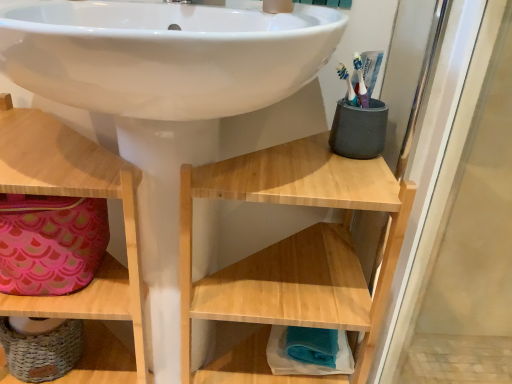
At what (x,y) coordinates should I click in order to perform the action: click on teal fabric towel at lower center, which is the 1th shelf in right-to-left order. Please return your answer as a coordinate pair (x, y). Image resolution: width=512 pixels, height=384 pixels. Looking at the image, I should click on (254, 366).

Locate an element on the screen. wooden shelf at lower left, marked as the 1th shelf in a left-to-right arrangement is located at coordinates (105, 256).

This screenshot has width=512, height=384. Identify the location of pink fabric bag at lower left. (50, 243).

In terms of height, does natural wood shelf at center, positioned as the 2th shelf in left-to-right order, look taller or shorter compared to teal fabric towel at lower center, which is the 1th shelf in right-to-left order?

Clearly, natural wood shelf at center, positioned as the 2th shelf in left-to-right order, is taller compared to teal fabric towel at lower center, which is the 1th shelf in right-to-left order.

Considering the sizes of objects natural wood shelf at center, which ranks as the 2th shelf in right-to-left order, and teal fabric towel at lower center, which is the 1th shelf in right-to-left order, in the image provided, who is bigger, natural wood shelf at center, which ranks as the 2th shelf in right-to-left order, or teal fabric towel at lower center, which is the 1th shelf in right-to-left order,?

natural wood shelf at center, which ranks as the 2th shelf in right-to-left order, is bigger.

Is natural wood shelf at center, positioned as the 2th shelf in left-to-right order, surrounding teal fabric towel at lower center, the third shelf positioned from the left?

Yes, teal fabric towel at lower center, the third shelf positioned from the left, is a part of natural wood shelf at center, positioned as the 2th shelf in left-to-right order.

Could you measure the distance between natural wood shelf at center, positioned as the 2th shelf in left-to-right order, and teal fabric towel at lower center, the third shelf positioned from the left?

natural wood shelf at center, positioned as the 2th shelf in left-to-right order, and teal fabric towel at lower center, the third shelf positioned from the left, are 9.62 inches apart from each other.

Does natural wood shelf at center, which ranks as the 2th shelf in right-to-left order, have a smaller size compared to white glossy sink at center?

Indeed, natural wood shelf at center, which ranks as the 2th shelf in right-to-left order, has a smaller size compared to white glossy sink at center.

Who is shorter, natural wood shelf at center, which ranks as the 2th shelf in right-to-left order, or white glossy sink at center?

natural wood shelf at center, which ranks as the 2th shelf in right-to-left order, is shorter.

Between natural wood shelf at center, positioned as the 2th shelf in left-to-right order, and white glossy sink at center, which one has larger width?

Wider between the two is white glossy sink at center.

Is natural wood shelf at center, positioned as the 2th shelf in left-to-right order, touching white glossy sink at center?

natural wood shelf at center, positioned as the 2th shelf in left-to-right order, is not next to white glossy sink at center, and they're not touching.

Considering the points (2, 147) and (20, 270), which point is in front, point (2, 147) or point (20, 270)?

Positioned in front is point (2, 147).

Find the location of a particular element. The width and height of the screenshot is (512, 384). the 1st shelf positioned below the pink fabric bag at lower left (from a real-world perspective) is located at coordinates (105, 256).

Is wooden shelf at lower left, the third shelf when ordered from right to left, positioned far away from pink fabric bag at lower left?

They are positioned close to each other.

From the image's perspective, which one is positioned higher, wooden shelf at lower left, the third shelf when ordered from right to left, or pink fabric bag at lower left?

pink fabric bag at lower left appears higher in the image.

From a real-world perspective, does natural wood shelf at center, which ranks as the 2th shelf in right-to-left order, stand above wooden shelf at lower left, the third shelf when ordered from right to left?

No.

Measure the distance between natural wood shelf at center, positioned as the 2th shelf in left-to-right order, and wooden shelf at lower left, the third shelf when ordered from right to left.

They are 9.92 inches apart.

Does natural wood shelf at center, positioned as the 2th shelf in left-to-right order, have a smaller size compared to wooden shelf at lower left, marked as the 1th shelf in a left-to-right arrangement?

Yes.

Which is more distant, (88, 217) or (304, 54)?

The point (88, 217) is farther from the camera.

Is pink fabric bag at lower left further to the viewer compared to white glossy sink at center?

Yes, pink fabric bag at lower left is further from the viewer.

In terms of width, does pink fabric bag at lower left look wider or thinner when compared to white glossy sink at center?

Considering their sizes, pink fabric bag at lower left looks slimmer than white glossy sink at center.

From a real-world perspective, is pink fabric bag at lower left above or below white glossy sink at center?

pink fabric bag at lower left is situated higher than white glossy sink at center in the real world.

Is wooden shelf at lower left, the third shelf when ordered from right to left, bigger than natural wood shelf at center, positioned as the 2th shelf in left-to-right order?

Indeed, wooden shelf at lower left, the third shelf when ordered from right to left, has a larger size compared to natural wood shelf at center, positioned as the 2th shelf in left-to-right order.

Which of these two, wooden shelf at lower left, marked as the 1th shelf in a left-to-right arrangement, or natural wood shelf at center, which ranks as the 2th shelf in right-to-left order, is thinner?

Thinner between the two is natural wood shelf at center, which ranks as the 2th shelf in right-to-left order.

Which is correct: wooden shelf at lower left, the third shelf when ordered from right to left, is inside natural wood shelf at center, which ranks as the 2th shelf in right-to-left order, or outside of it?

wooden shelf at lower left, the third shelf when ordered from right to left, is not inside natural wood shelf at center, which ranks as the 2th shelf in right-to-left order, it's outside.

In the image, is wooden shelf at lower left, marked as the 1th shelf in a left-to-right arrangement, positioned in front of or behind natural wood shelf at center, positioned as the 2th shelf in left-to-right order?

wooden shelf at lower left, marked as the 1th shelf in a left-to-right arrangement, is in front of natural wood shelf at center, positioned as the 2th shelf in left-to-right order.

Consider the image. Is wooden shelf at lower left, marked as the 1th shelf in a left-to-right arrangement, at the back of white glossy sink at center?

That's right, white glossy sink at center is facing away from wooden shelf at lower left, marked as the 1th shelf in a left-to-right arrangement.

Which point is more distant from viewer, (100, 97) or (52, 186)?

Point (52, 186)

Between white glossy sink at center and wooden shelf at lower left, the third shelf when ordered from right to left, which one is positioned in front?

white glossy sink at center.

Image resolution: width=512 pixels, height=384 pixels. There is a teal fabric towel at lower center, which is the 1th shelf in right-to-left order. Identify the location of the 1st shelf above it (from a real-world perspective). (292, 255).

This screenshot has height=384, width=512. In order to click on sink to the left of natural wood shelf at center, which ranks as the 2th shelf in right-to-left order in this screenshot , I will do `click(165, 98)`.

Estimate the real-world distances between objects in this image. Which object is closer to pink fabric bag at lower left, white glossy sink at center or teal fabric towel at lower center, which is the 1th shelf in right-to-left order?

The object closer to pink fabric bag at lower left is white glossy sink at center.

Considering their positions, is white glossy sink at center positioned closer to pink fabric bag at lower left than natural wood shelf at center, positioned as the 2th shelf in left-to-right order?

The object closer to pink fabric bag at lower left is white glossy sink at center.

Based on their spatial positions, is wooden shelf at lower left, marked as the 1th shelf in a left-to-right arrangement, or pink fabric bag at lower left further from teal fabric towel at lower center, the third shelf positioned from the left?

pink fabric bag at lower left is further to teal fabric towel at lower center, the third shelf positioned from the left.

Which object lies nearer to the anchor point natural wood shelf at center, which ranks as the 2th shelf in right-to-left order, teal fabric towel at lower center, which is the 1th shelf in right-to-left order, or white glossy sink at center?

white glossy sink at center lies closer to natural wood shelf at center, which ranks as the 2th shelf in right-to-left order, than the other object.

Based on the photo, which object lies nearer to the anchor point white glossy sink at center, natural wood shelf at center, which ranks as the 2th shelf in right-to-left order, or pink fabric bag at lower left?

natural wood shelf at center, which ranks as the 2th shelf in right-to-left order.

Looking at the image, which one is located closer to pink fabric bag at lower left, natural wood shelf at center, which ranks as the 2th shelf in right-to-left order, or wooden shelf at lower left, the third shelf when ordered from right to left?

wooden shelf at lower left, the third shelf when ordered from right to left, is positioned closer to the anchor pink fabric bag at lower left.

Estimate the real-world distances between objects in this image. Which object is further from natural wood shelf at center, which ranks as the 2th shelf in right-to-left order, white glossy sink at center or pink fabric bag at lower left?

pink fabric bag at lower left is positioned further to the anchor natural wood shelf at center, which ranks as the 2th shelf in right-to-left order.

Considering their positions, is natural wood shelf at center, which ranks as the 2th shelf in right-to-left order, positioned closer to teal fabric towel at lower center, which is the 1th shelf in right-to-left order, than white glossy sink at center?

The object closer to teal fabric towel at lower center, which is the 1th shelf in right-to-left order, is natural wood shelf at center, which ranks as the 2th shelf in right-to-left order.

Identify the location of shelf situated between pink fabric bag at lower left and natural wood shelf at center, which ranks as the 2th shelf in right-to-left order, from left to right. (105, 256).

Find the location of a particular element. The height and width of the screenshot is (384, 512). sink located between pink fabric bag at lower left and teal fabric towel at lower center, the third shelf positioned from the left, in the left-right direction is located at coordinates (165, 98).

This screenshot has height=384, width=512. In order to click on sink situated between pink fabric bag at lower left and natural wood shelf at center, positioned as the 2th shelf in left-to-right order, from left to right in this screenshot , I will do `click(165, 98)`.

At what (x,y) coordinates should I click in order to perform the action: click on shelf situated between wooden shelf at lower left, marked as the 1th shelf in a left-to-right arrangement, and teal fabric towel at lower center, the third shelf positioned from the left, from left to right. Please return your answer as a coordinate pair (x, y). Looking at the image, I should click on (292, 255).